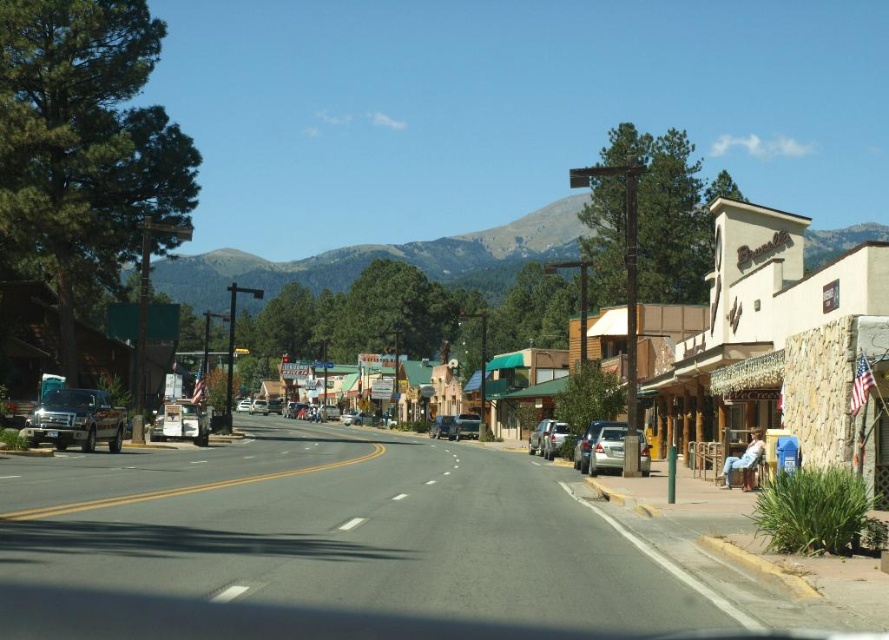
You are a pedestrian standing at the start of the road and want to cross to the left side. There are two cars in the center of the road, a matte black car at center and a silver metallic sedan at center. Which car is closer to the right edge of the road?

The matte black car at center is positioned on the right side of the silver metallic sedan at center, so it is closer to the right edge of the road.

You are standing at the point marked by the coordinates (761, 301) on this street. Looking around, you notice a stone building at center. Can you tell me which direction the stone building at center is located relative to your current position?

→ The stone building at center is located exactly at the point (761, 301), which is your current position, so you are standing right at the stone building at center.